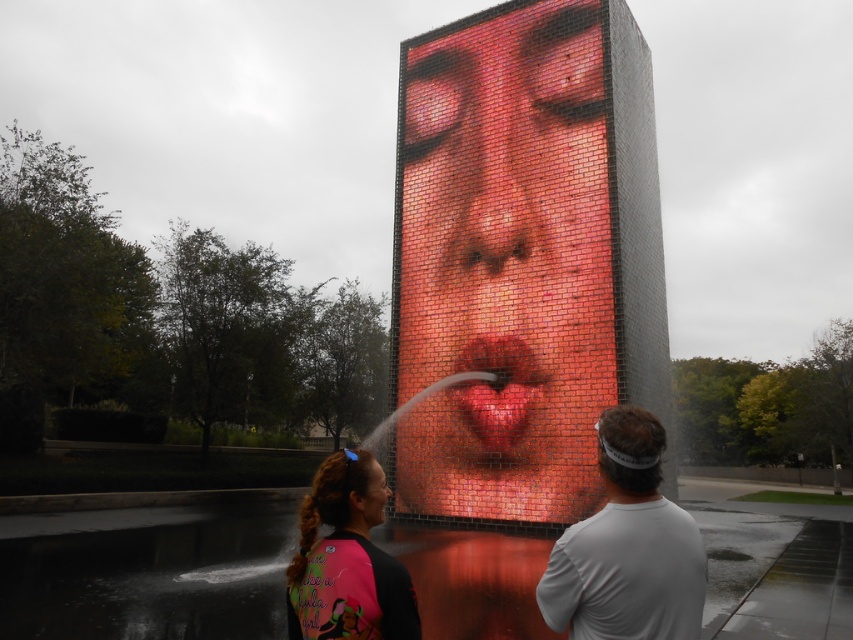
You are a photographer trying to capture the white matte shirt at center and the matte red brick nose at center in the same frame. Which object should you focus on first if you want to ensure both are in focus without adjusting your camera settings?

You should focus on the matte red brick nose at center first because it is taller than the white matte shirt at center, so focusing on the taller object increases the chances of both being in focus.

You are a photographer trying to capture both the white matte shirt at center and the smooth glossy lips at center in the same frame. Based on the scene description, can you fit both subjects into your camera frame without moving? Explain your reasoning.

The white matte shirt at center and the smooth glossy lips at center are 5.99 meters apart. Since the distance between them is less than the maximum field of view of most cameras, it is possible to capture both in the same frame without moving, provided the camera is positioned appropriately.